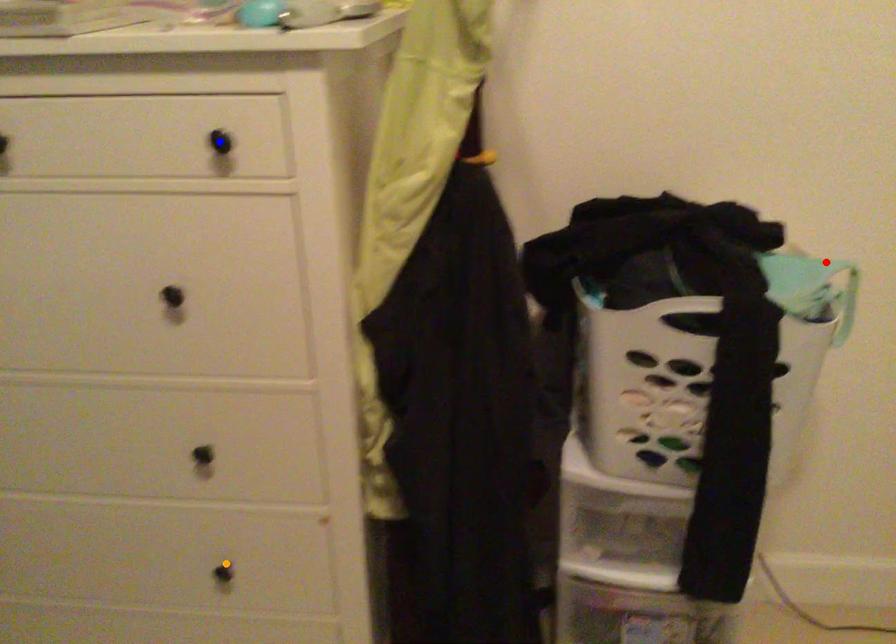
Order these from nearest to farthest:
orange point
red point
blue point

1. orange point
2. red point
3. blue point